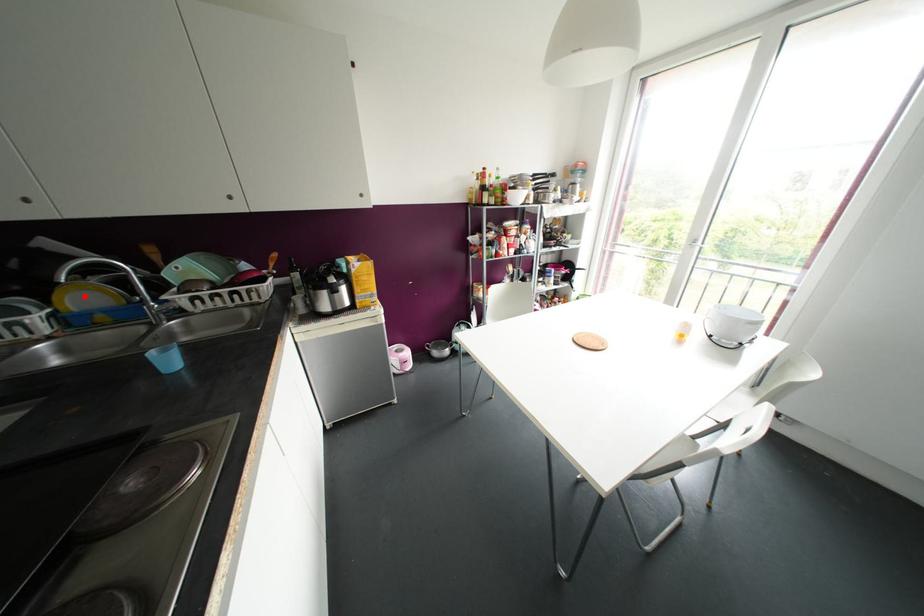
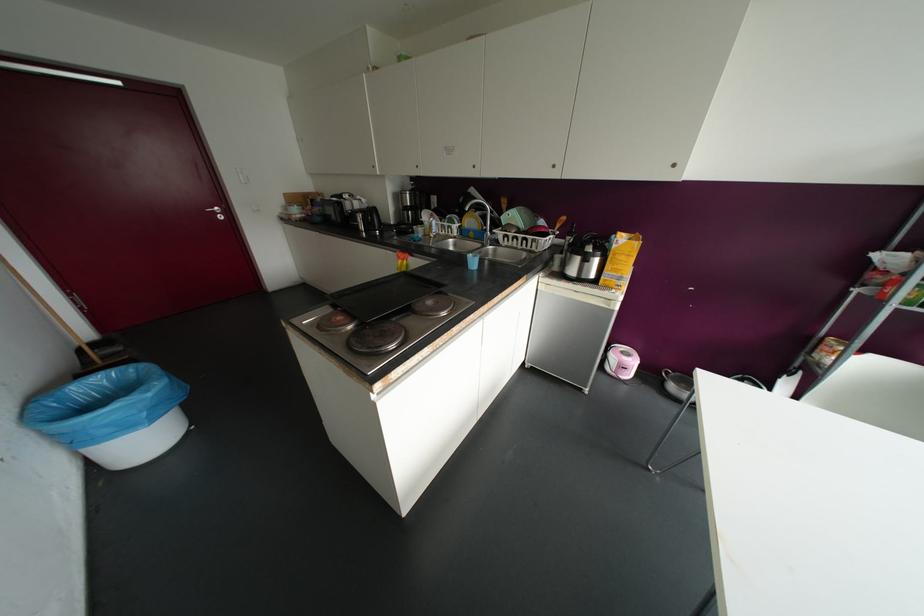
The point at the highlighted location is marked in the first image. Where is the corresponding point in the second image?

(469, 221)